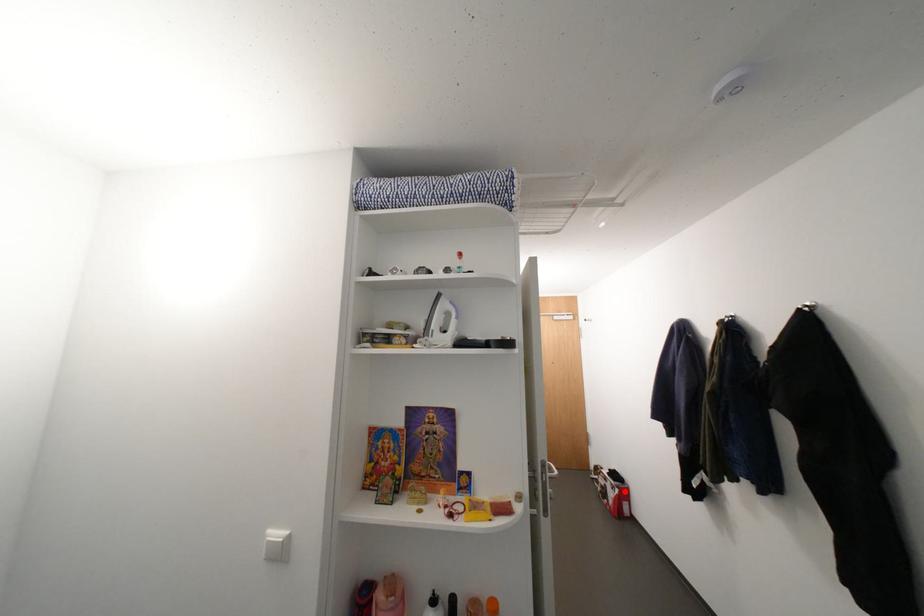
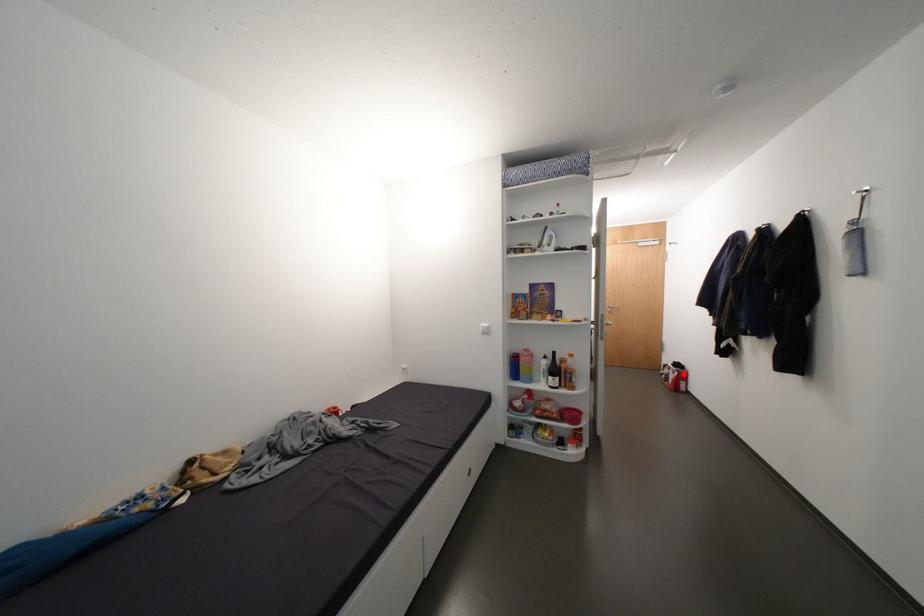
I am providing you with two images of the same scene from different viewpoints. A red point is marked on the first image and another point is marked on the second image. Is the red point in image1 aligned with the point shown in image2?

Yes